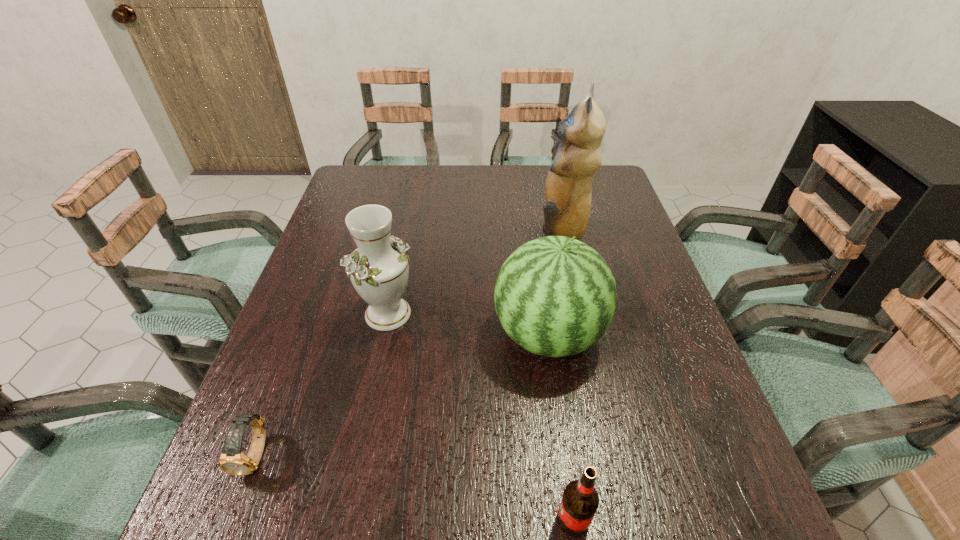
Identify the location of the tallest object. (568, 190).

You are a GUI agent. You are given a task and a screenshot of the screen. Output one action in this format:
    pyautogui.click(x=<x>, y=<y>)
    Task: Click on the farthest object
    The height and width of the screenshot is (540, 960).
    Given the screenshot: What is the action you would take?
    pyautogui.click(x=568, y=190)

Identify the location of vase. (378, 269).

I want to click on watermelon, so click(555, 296).

You are a GUI agent. You are given a task and a screenshot of the screen. Output one action in this format:
    pyautogui.click(x=<x>, y=<y>)
    Task: Click on the root beer
    The height and width of the screenshot is (540, 960).
    Given the screenshot: What is the action you would take?
    pyautogui.click(x=580, y=501)

Image resolution: width=960 pixels, height=540 pixels. What are the coordinates of `the nearest object` in the screenshot? It's located at (580, 501).

Locate an element on the screen. the leftmost object is located at coordinates (232, 460).

The height and width of the screenshot is (540, 960). What are the coordinates of `the second nearest object` in the screenshot? It's located at (232, 460).

Image resolution: width=960 pixels, height=540 pixels. I want to click on vacant point located on the face of the cat, so click(x=420, y=234).

I want to click on vacant space located 0.110m on the face of the cat, so click(x=496, y=234).